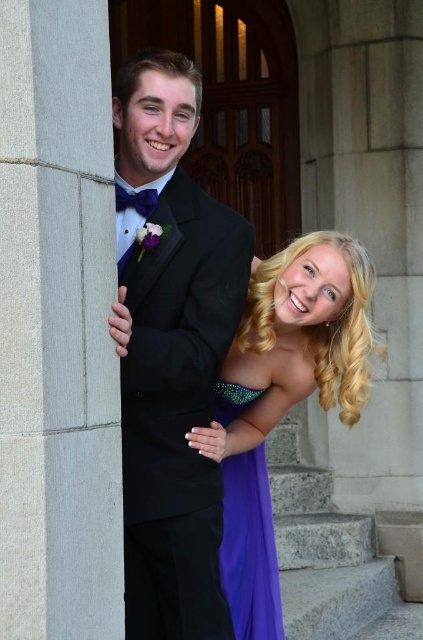
Question: Considering the real-world distances, which object is farthest from the black satin tuxedo at center?

Choices:
 (A) purple satin dress at lower right
 (B) purple satin dress at center

Answer: (B)

Question: Does black satin tuxedo at center appear over purple satin dress at lower right?

Choices:
 (A) no
 (B) yes

Answer: (B)

Question: Which object is closer to the camera taking this photo?

Choices:
 (A) gray stone pillar at left
 (B) black satin tuxedo at center
 (C) purple satin dress at center

Answer: (A)

Question: Can you confirm if gray stone pillar at left is positioned to the right of purple satin dress at lower right?

Choices:
 (A) no
 (B) yes

Answer: (A)

Question: Which object is closer to the camera taking this photo?

Choices:
 (A) purple satin dress at lower right
 (B) gray stone pillar at left
 (C) purple satin dress at center

Answer: (B)

Question: Does black satin tuxedo at center have a larger size compared to purple satin dress at center?

Choices:
 (A) no
 (B) yes

Answer: (B)